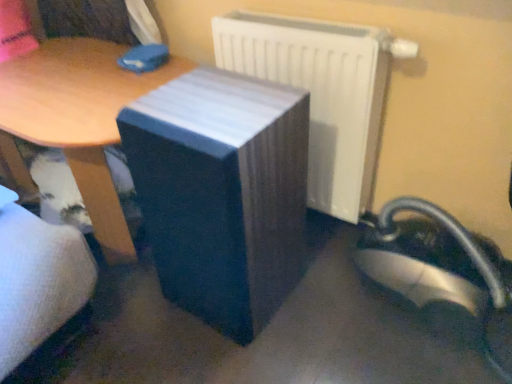
Locate an element on the screen. This screenshot has width=512, height=384. free space to the left of matte black speaker at center, which is counted as the 1th table, starting from the right is located at coordinates (136, 315).